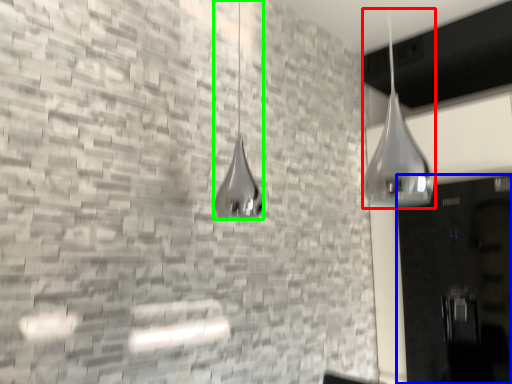
Question: Which object is the farthest from shower (highlighted by a red box)? Choose among these: door (highlighted by a blue box) or shower (highlighted by a green box).

Choices:
 (A) door
 (B) shower

Answer: (B)